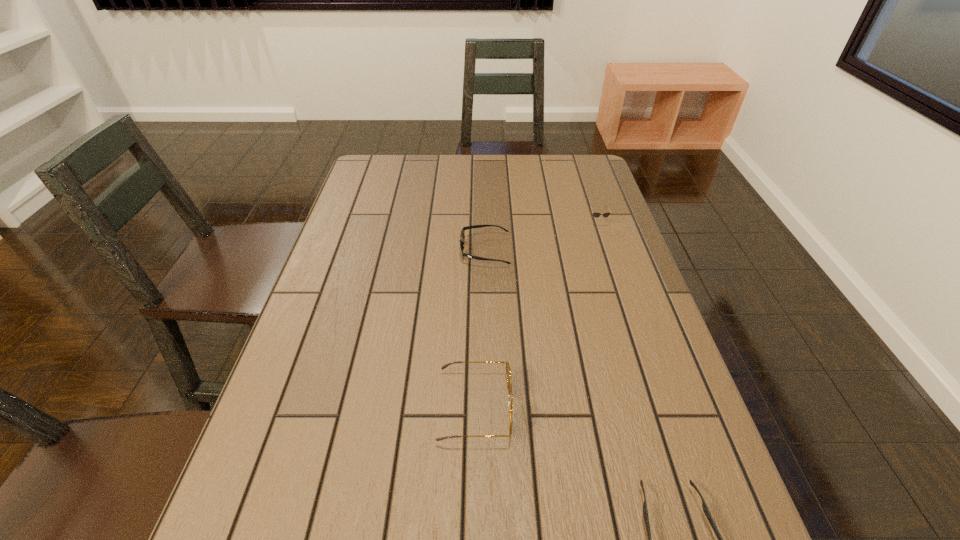
Identify which sunglasses is located as the second nearest to the farthest sunglasses. Please provide its 2D coordinates. Your answer should be formatted as a tuple, i.e. [(x, y)], where the tuple contains the x and y coordinates of a point satisfying the conditions above.

[(508, 372)]

Locate an element on the screen. The height and width of the screenshot is (540, 960). sunglasses that is the second nearest to the third shortest sunglasses is located at coordinates (508, 372).

Find the location of a particular element. The image size is (960, 540). vacant space that satisfies the following two spatial constraints: 1. in front of the lenses of the third shortest object; 2. on the front-facing side of the second farthest sunglasses is located at coordinates pyautogui.click(x=607, y=250).

At what (x,y) coordinates should I click in order to perform the action: click on free space that satisfies the following two spatial constraints: 1. in front of the lenses of the second tallest object; 2. on the lenses of the third farthest object. Please return your answer as a coordinate pair (x, y). The image size is (960, 540). Looking at the image, I should click on (658, 407).

Locate an element on the screen. vacant position in the image that satisfies the following two spatial constraints: 1. in front of the lenses of the third shortest object; 2. on the front-facing side of the second farthest object is located at coordinates (607, 250).